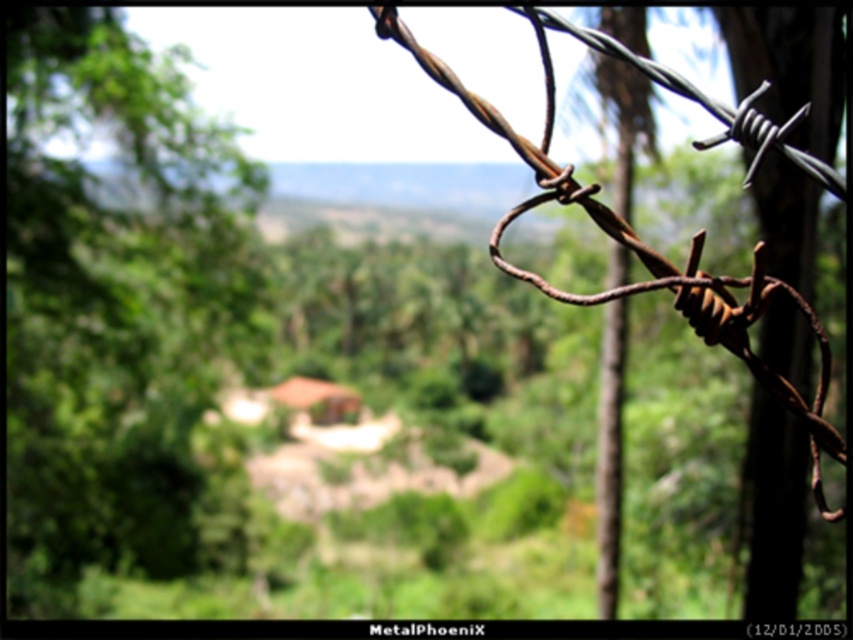
Is point (74, 280) positioned in front of point (498, 227)?

No, it is not.

This screenshot has width=853, height=640. What are the coordinates of `green leafy tree at left` in the screenshot? It's located at pos(114,308).